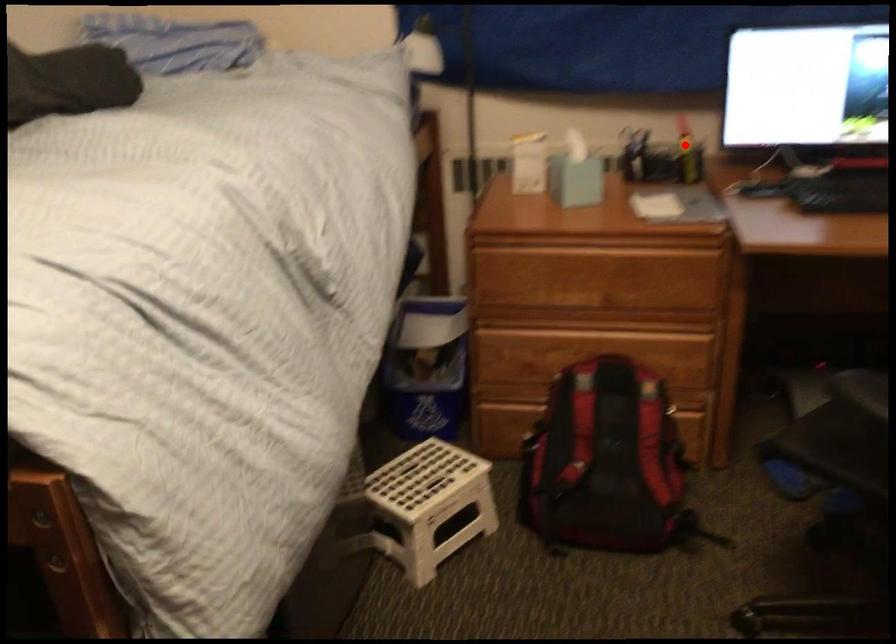
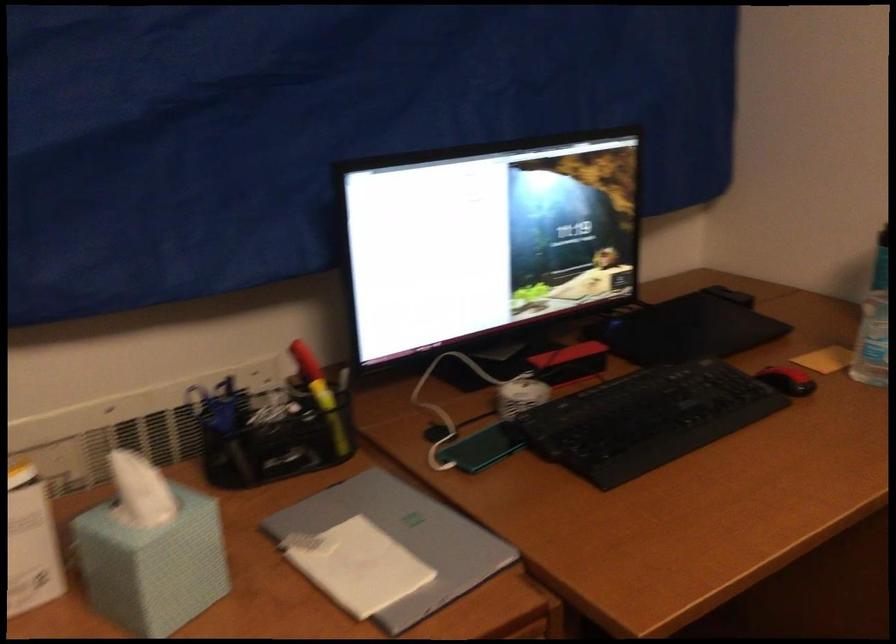
Question: I am providing you with two images of the same scene from different viewpoints. Image1 has a red point marked. In image2, the corresponding 3D location appears at what relative position? Reply with the corresponding letter.

Choices:
 (A) Closer
 (B) Farther

Answer: (A)